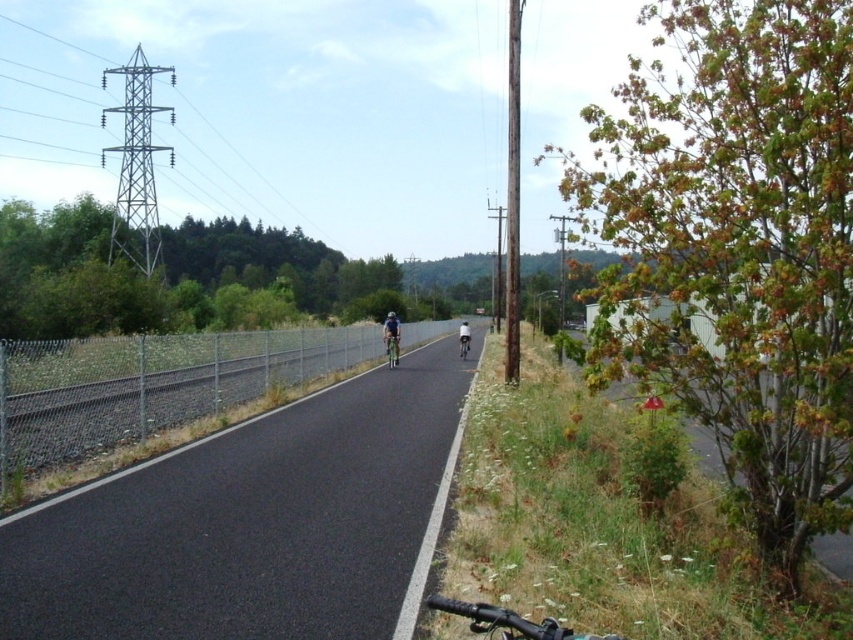
You are standing at the center of the road and see two points marked on the road ahead. The first point is at coordinates point [395,349] and the second is at point [466,324]. Which point is closer to you?

Point [395,349] is closer to the viewer than point [466,324].

You are a cyclist who just arrived at the scene. You see a blue fabric helmet at center and a white matte bicycle helmet at center. Which helmet is placed higher in the scene?

The blue fabric helmet at center is positioned over the white matte bicycle helmet at center, so it is higher.

What is the 2D coordinate of the asphalt road at center?

The 2D coordinate of the asphalt road at center is at point (251, 522).